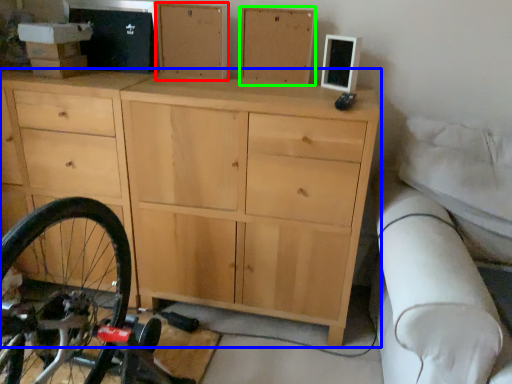
Question: Estimate the real-world distances between objects in this image. Which object is farther from chest of drawer (highlighted by a red box), chest of drawers (highlighted by a blue box) or chest of drawer (highlighted by a green box)?

Choices:
 (A) chest of drawers
 (B) chest of drawer

Answer: (A)